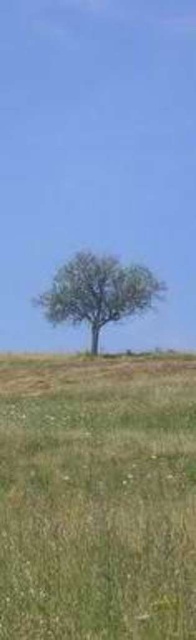
You are standing at the point labeled as point (x=97, y=497) in the image. What do you see around you?

You are standing in the green grassy field at center, as indicated by point (x=97, y=497).

You are a hiker standing in the middle of the green grassy field at center and looking towards the green leafy tree at center. Which object is taller from your perspective?

The green leafy tree at center is taller than the green grassy field at center.